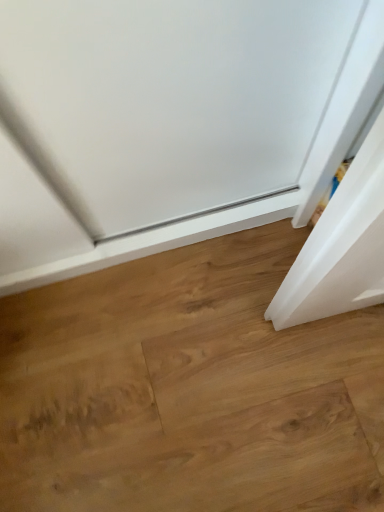
At what (x,y) coordinates should I click in order to perform the action: click on empty space that is ontop of natural wood flooring at center (from a real-world perspective). Please return your answer as a coordinate pair (x, y). The width and height of the screenshot is (384, 512). Looking at the image, I should click on (x=187, y=349).